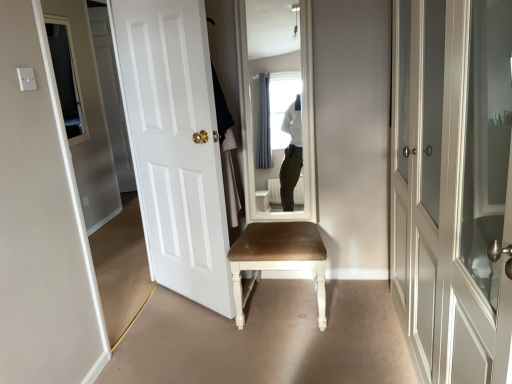
Image resolution: width=512 pixels, height=384 pixels. I want to click on vacant region in front of brown leather chair at center, so click(x=292, y=352).